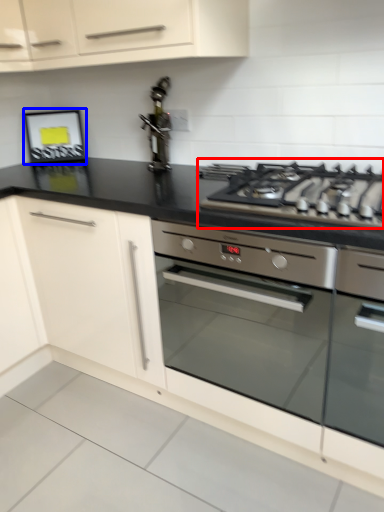
Question: Which of the following is the closest to the observer, gas stove (highlighted by a red box) or picture frame (highlighted by a blue box)?

Choices:
 (A) gas stove
 (B) picture frame

Answer: (A)